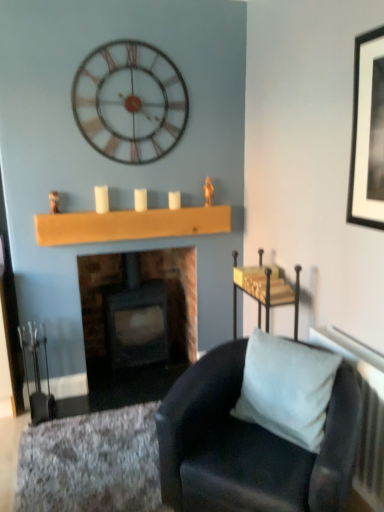
The image size is (384, 512). Identify the location of free space above textured gray rug at lower left (from a real-world perspective). (86, 446).